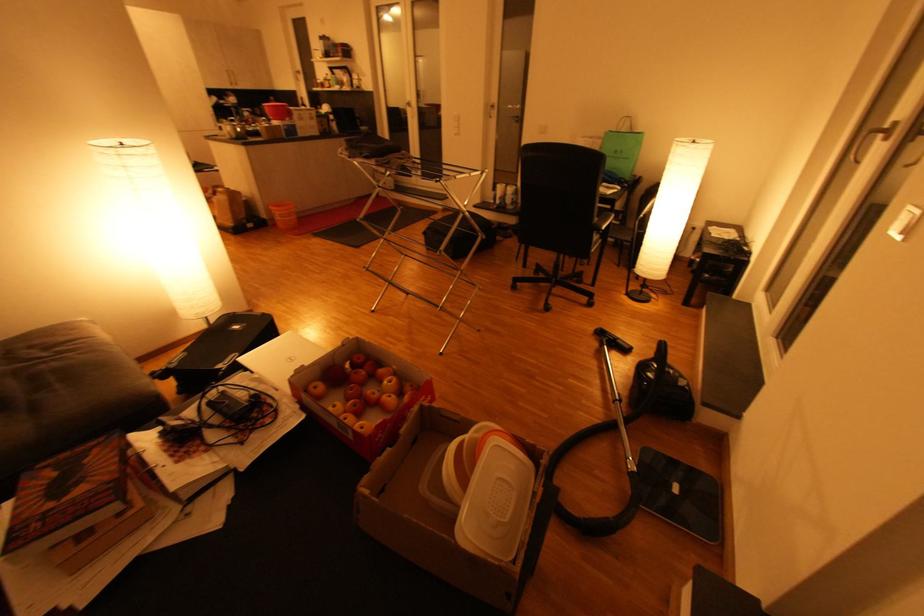
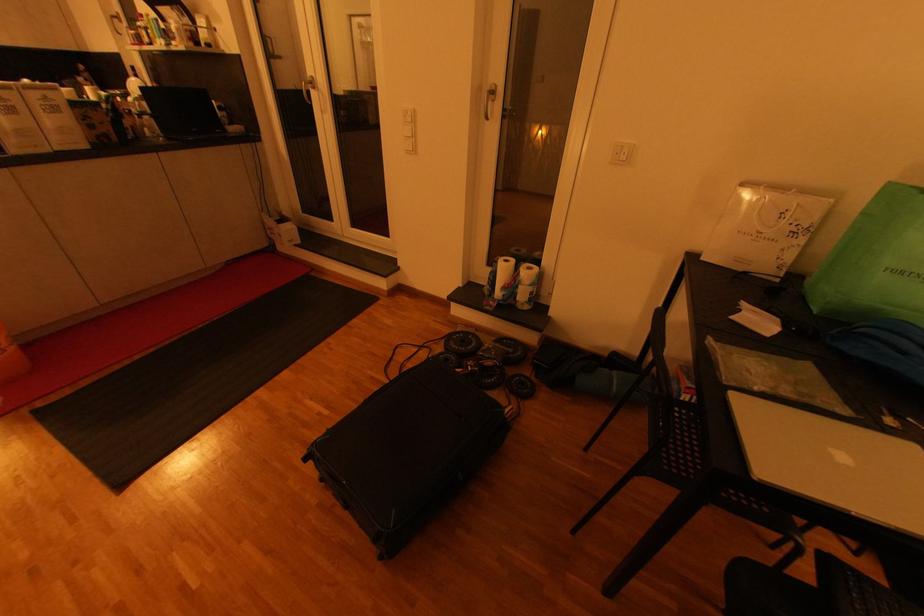
Find the pixel in the second image that matches the point at 460,136 in the first image.

(412, 153)